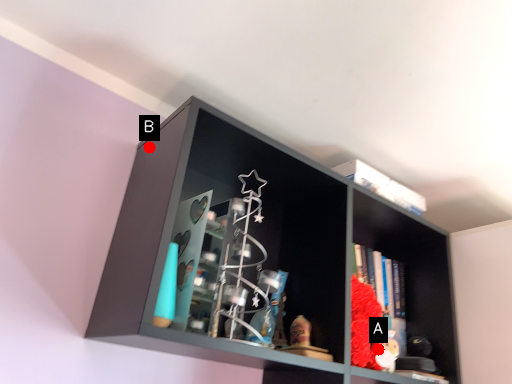
Question: Two points are circled on the image, labeled by A and B beside each circle. Which point appears farthest from the camera in this image?

Choices:
 (A) A is further
 (B) B is further

Answer: (B)